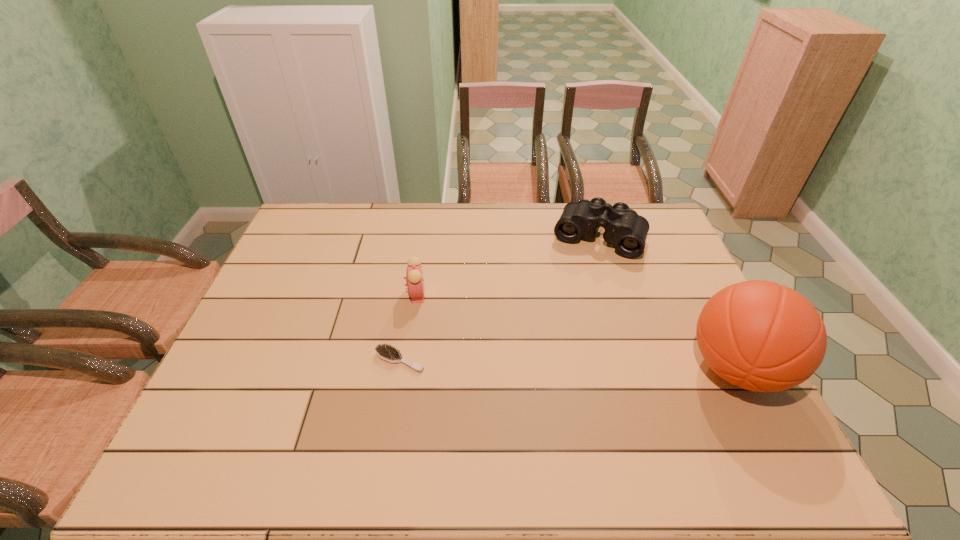
Identify the location of free location located at the eyepieces of the binoculars. This screenshot has height=540, width=960. (582, 273).

Locate an element on the screen. The height and width of the screenshot is (540, 960). vacant space located at the eyepieces of the binoculars is located at coordinates (554, 346).

At what (x,y) coordinates should I click in order to perform the action: click on object that is at the far edge. Please return your answer as a coordinate pair (x, y). The width and height of the screenshot is (960, 540). Looking at the image, I should click on (624, 228).

Locate an element on the screen. Image resolution: width=960 pixels, height=540 pixels. object at the near edge is located at coordinates (761, 336).

The image size is (960, 540). What are the coordinates of `basketball situated at the right edge` in the screenshot? It's located at (761, 336).

Locate an element on the screen. Image resolution: width=960 pixels, height=540 pixels. binoculars situated at the right edge is located at coordinates (624, 228).

You are a GUI agent. You are given a task and a screenshot of the screen. Output one action in this format:
    pyautogui.click(x=<x>, y=<y>)
    Task: Click on the object situated at the far right corner
    The width and height of the screenshot is (960, 540).
    Given the screenshot: What is the action you would take?
    pyautogui.click(x=624, y=228)

The image size is (960, 540). What are the coordinates of `object at the near right corner` in the screenshot? It's located at (761, 336).

What are the coordinates of `free space at the far edge of the desktop` in the screenshot? It's located at (485, 234).

Where is `vacant space at the near edge of the desktop`? vacant space at the near edge of the desktop is located at coordinates (642, 408).